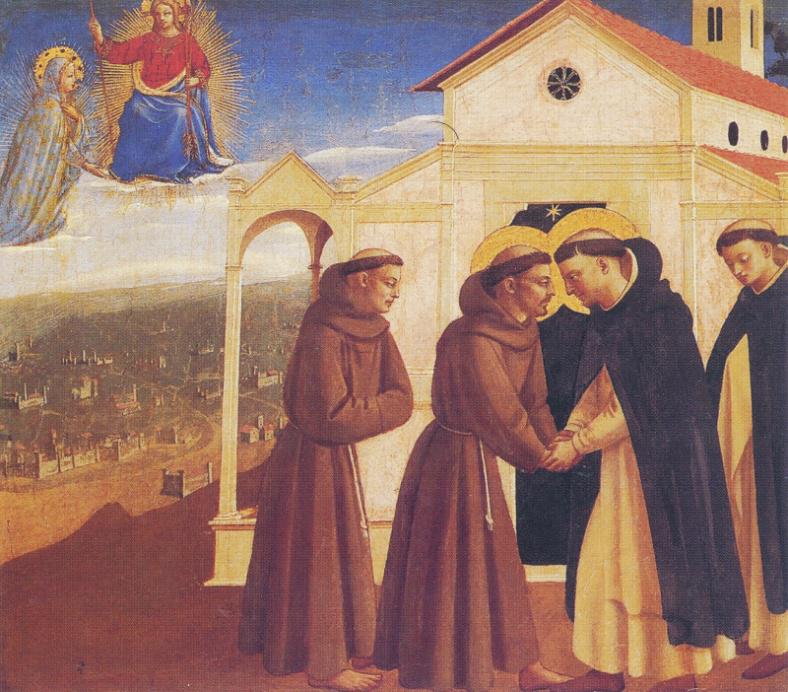
Image resolution: width=788 pixels, height=692 pixels. Find the location of `floor`. floor is located at coordinates (125, 614).